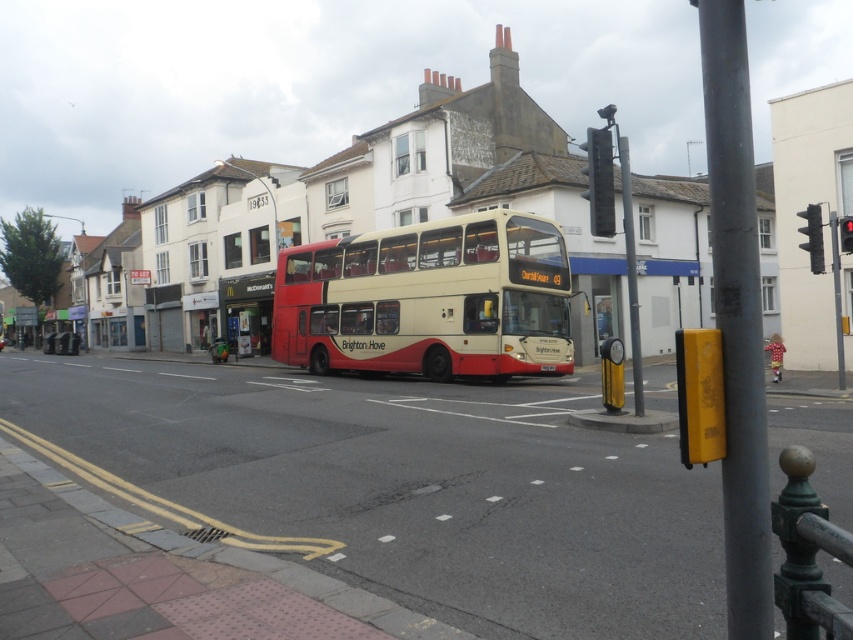
You are a pedestrian waiting at the crosswalk near the metallic red traffic light at right and the red plastic traffic light at upper right. Which traffic light is closer to you?

The metallic red traffic light at right is closer to you because it appears smaller than the red plastic traffic light at upper right. In perspective, objects closer to the viewer are smaller in the image.

You are standing at the point marked by point (595, 140) and want to walk to point (821, 268). Given that both points are on the road, will you be walking towards the bus or away from it?

Since point (595, 140) is closer to the camera than point (821, 268), walking from point (595, 140) to point (821, 268) means moving away from the camera. The bus is positioned near the center of the frame, so if the camera is facing the bus, moving away from the camera would mean walking away from the bus. Therefore, you would be walking away from the bus.

In the scene shown: You are a pedestrian waiting at the crosswalk near the metallic red traffic light at right and the red plastic traffic light at upper right. Which traffic light has a smaller width?

The metallic red traffic light at right is thinner than the red plastic traffic light at upper right, so the metallic red traffic light at right has a smaller width.